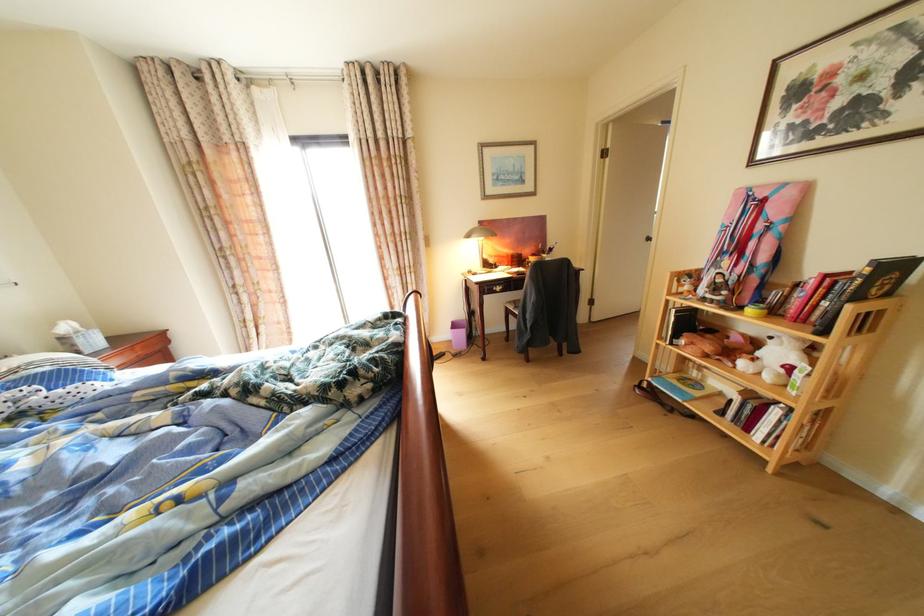
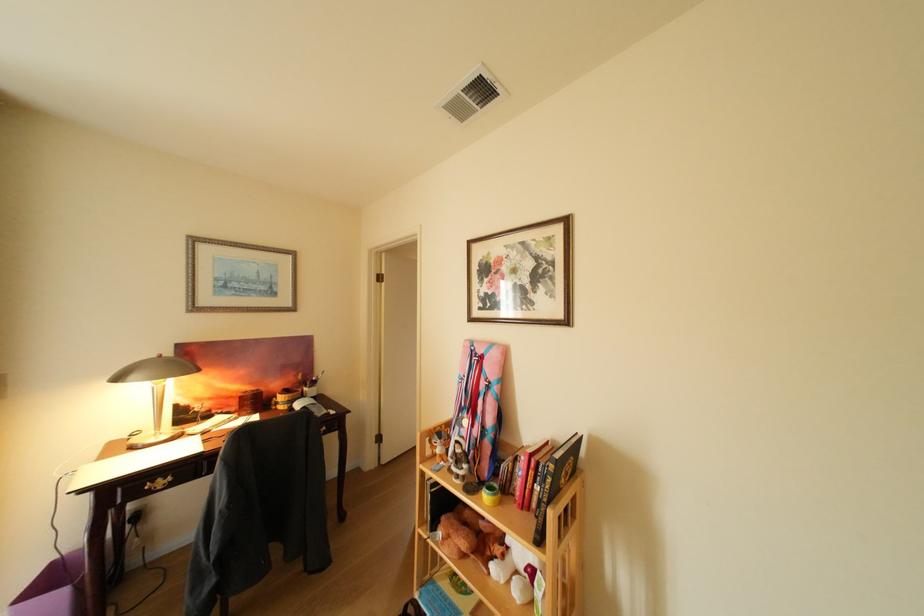
The point at (468, 328) is marked in the first image. Where is the corresponding point in the second image?

(62, 581)